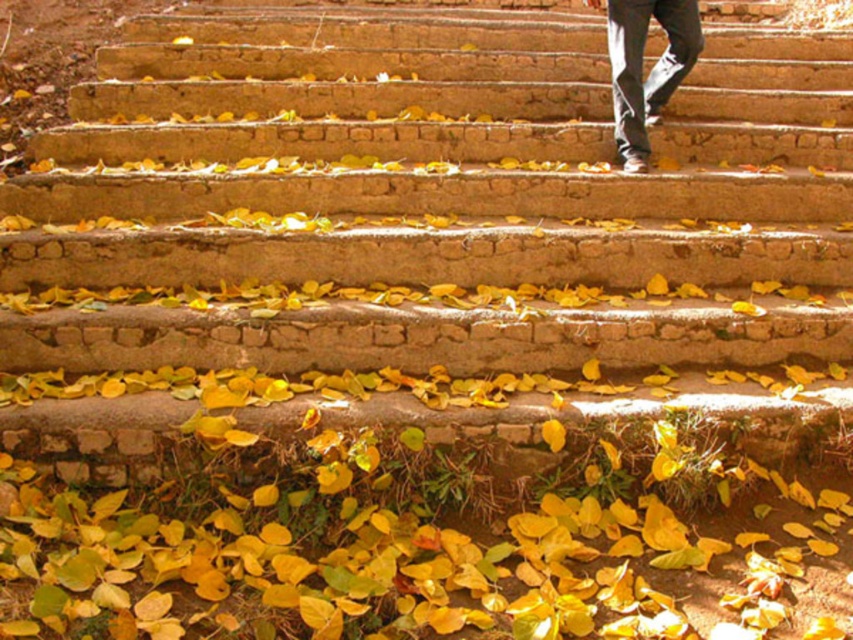
Question: Is yellow matte leaves at bottom positioned at the back of dark gray jeans at upper center?

Choices:
 (A) yes
 (B) no

Answer: (B)

Question: Which object appears farthest from the camera in this image?

Choices:
 (A) dark gray jeans at upper center
 (B) yellow matte leaves at bottom

Answer: (A)

Question: From the image, what is the correct spatial relationship of yellow matte leaves at bottom in relation to dark gray jeans at upper center?

Choices:
 (A) right
 (B) left

Answer: (B)

Question: Does yellow matte leaves at bottom have a smaller size compared to dark gray jeans at upper center?

Choices:
 (A) yes
 (B) no

Answer: (B)

Question: Which point is closer to the camera?

Choices:
 (A) dark gray jeans at upper center
 (B) yellow matte leaves at bottom

Answer: (B)